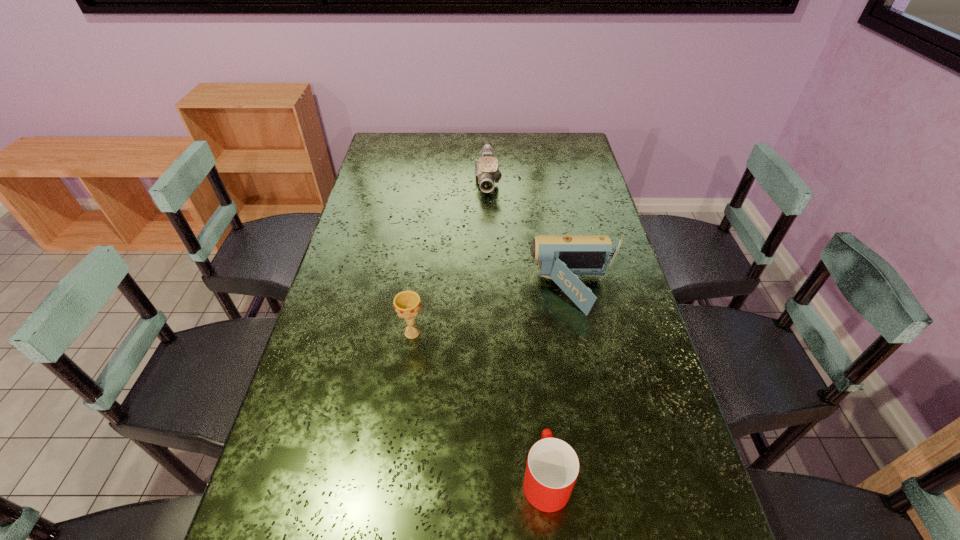
You are a GUI agent. You are given a task and a screenshot of the screen. Output one action in this format:
    pyautogui.click(x=<x>, y=<y>)
    Task: Click on the farther camcorder
    
    Given the screenshot: What is the action you would take?
    pyautogui.click(x=487, y=171)

Locate an element on the screen. The image size is (960, 540). the left camcorder is located at coordinates (487, 171).

Locate an element on the screen. This screenshot has width=960, height=540. the right camcorder is located at coordinates (561, 258).

Locate an element on the screen. The height and width of the screenshot is (540, 960). the third nearest object is located at coordinates (561, 258).

This screenshot has height=540, width=960. Identify the location of the third farthest object. (407, 304).

The width and height of the screenshot is (960, 540). Find the location of `the leftmost object`. the leftmost object is located at coordinates (407, 304).

At what (x,y) coordinates should I click in order to perform the action: click on the nearest object. Please return your answer as a coordinate pair (x, y). The height and width of the screenshot is (540, 960). Looking at the image, I should click on (552, 468).

Where is `vacant space located on the front-facing side of the left camcorder`? vacant space located on the front-facing side of the left camcorder is located at coordinates (489, 238).

Where is `vacant space located 0.350m on the side of the right camcorder with the flip-out screen`? The image size is (960, 540). vacant space located 0.350m on the side of the right camcorder with the flip-out screen is located at coordinates (x=410, y=292).

Find the location of a particular element. Image resolution: width=960 pixels, height=540 pixels. vacant space located 0.320m on the side of the right camcorder with the flip-out screen is located at coordinates (420, 292).